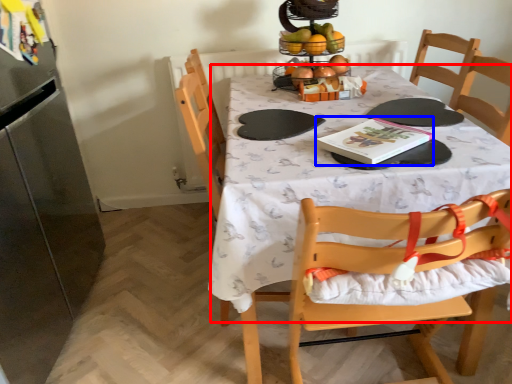
Question: Which object is closer to the camera taking this photo, tablecloth (highlighted by a red box) or book (highlighted by a blue box)?

Choices:
 (A) tablecloth
 (B) book

Answer: (A)